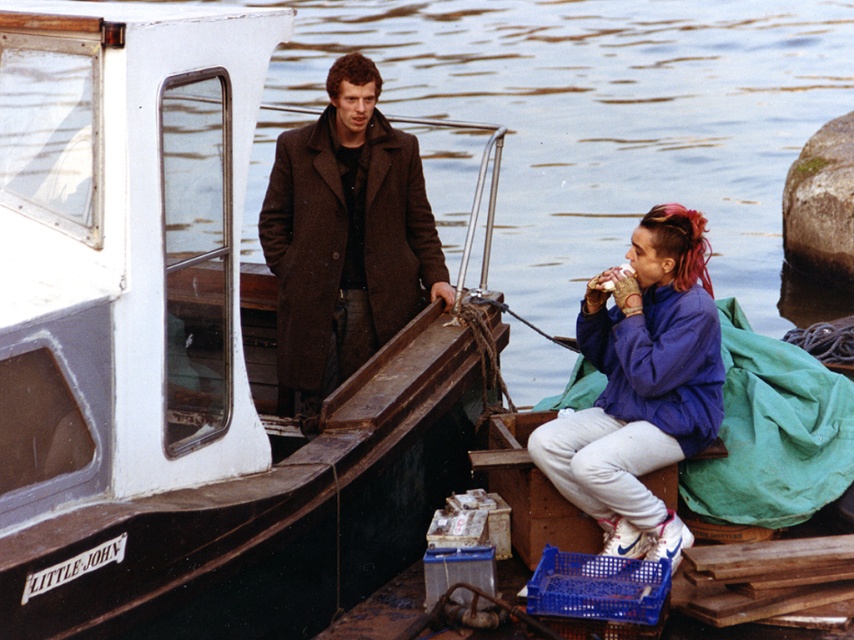
Question: Is brown wool coat at left positioned behind purple fleece jacket at lower right?

Choices:
 (A) no
 (B) yes

Answer: (B)

Question: Which point is closer to the camera taking this photo?

Choices:
 (A) (282, 364)
 (B) (681, 346)
 (C) (36, 344)

Answer: (C)

Question: Does white painted wood boat at center have a lesser width compared to brown wool coat at left?

Choices:
 (A) no
 (B) yes

Answer: (A)

Question: Which of the following is the closest to the observer?

Choices:
 (A) white painted wood boat at center
 (B) brown wool coat at left

Answer: (A)

Question: Which point appears farthest from the camera in this image?

Choices:
 (A) (250, 132)
 (B) (624, 310)

Answer: (B)

Question: Can you confirm if white painted wood boat at center is positioned to the left of purple fleece jacket at lower right?

Choices:
 (A) yes
 (B) no

Answer: (A)